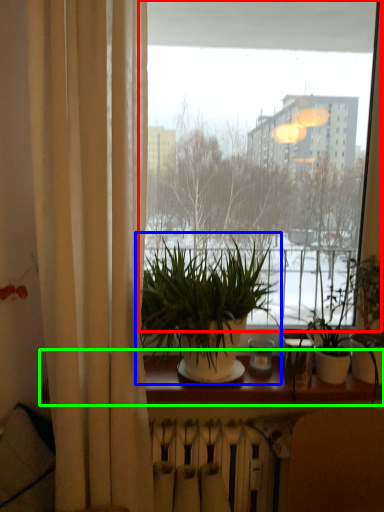
Question: Considering the real-world distances, which object is farthest from window (highlighted by a red box)? houseplant (highlighted by a blue box) or window sill (highlighted by a green box)?

Choices:
 (A) houseplant
 (B) window sill

Answer: (B)